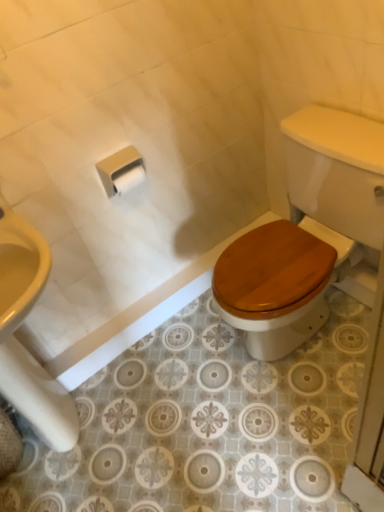
Question: Is white matte toilet paper at upper center, which appears as the second toilet paper when viewed from the front, taller than wooden at lower right?

Choices:
 (A) no
 (B) yes

Answer: (A)

Question: Considering the relative positions of white matte toilet paper at upper center, which appears as the second toilet paper when viewed from the front, and wooden at lower right in the image provided, is white matte toilet paper at upper center, which appears as the second toilet paper when viewed from the front, to the left of wooden at lower right from the viewer's perspective?

Choices:
 (A) no
 (B) yes

Answer: (B)

Question: Is white matte toilet paper at upper center, which is counted as the first toilet paper, starting from the back, in front of wooden at lower right?

Choices:
 (A) yes
 (B) no

Answer: (B)

Question: From a real-world perspective, is white matte toilet paper at upper center, which appears as the second toilet paper when viewed from the front, located beneath wooden at lower right?

Choices:
 (A) no
 (B) yes

Answer: (A)

Question: Considering the relative sizes of white matte toilet paper at upper center, which is counted as the first toilet paper, starting from the back, and wooden at lower right in the image provided, is white matte toilet paper at upper center, which is counted as the first toilet paper, starting from the back, thinner than wooden at lower right?

Choices:
 (A) yes
 (B) no

Answer: (A)

Question: From the image's perspective, is white matte toilet paper at center, marked as the 1th toilet paper in a front-to-back arrangement, above or below white matte toilet paper at upper center, which is counted as the first toilet paper, starting from the back?

Choices:
 (A) above
 (B) below

Answer: (A)

Question: Is point (109, 190) closer or farther from the camera than point (125, 189)?

Choices:
 (A) farther
 (B) closer

Answer: (B)

Question: In the image, is white matte toilet paper at center, marked as the 1th toilet paper in a front-to-back arrangement, on the left side or the right side of white matte toilet paper at upper center, which appears as the second toilet paper when viewed from the front?

Choices:
 (A) left
 (B) right

Answer: (A)

Question: Is white matte toilet paper at center, positioned as the second toilet paper in back-to-front order, wider or thinner than white matte toilet paper at upper center, which is counted as the first toilet paper, starting from the back?

Choices:
 (A) wide
 (B) thin

Answer: (A)

Question: From a real-world perspective, is wooden at lower right physically located above or below white matte toilet paper at center, positioned as the second toilet paper in back-to-front order?

Choices:
 (A) below
 (B) above

Answer: (A)

Question: Is wooden at lower right taller or shorter than white matte toilet paper at center, positioned as the second toilet paper in back-to-front order?

Choices:
 (A) short
 (B) tall

Answer: (B)

Question: Based on their positions, is wooden at lower right located to the left or right of white matte toilet paper at center, positioned as the second toilet paper in back-to-front order?

Choices:
 (A) left
 (B) right

Answer: (B)

Question: Based on their sizes in the image, would you say wooden at lower right is bigger or smaller than white matte toilet paper at center, positioned as the second toilet paper in back-to-front order?

Choices:
 (A) small
 (B) big

Answer: (B)

Question: From the image's perspective, is white matte toilet paper at center, positioned as the second toilet paper in back-to-front order, above or below wooden at lower right?

Choices:
 (A) above
 (B) below

Answer: (A)

Question: Relative to wooden at lower right, is white matte toilet paper at center, marked as the 1th toilet paper in a front-to-back arrangement, in front or behind?

Choices:
 (A) behind
 (B) front

Answer: (A)